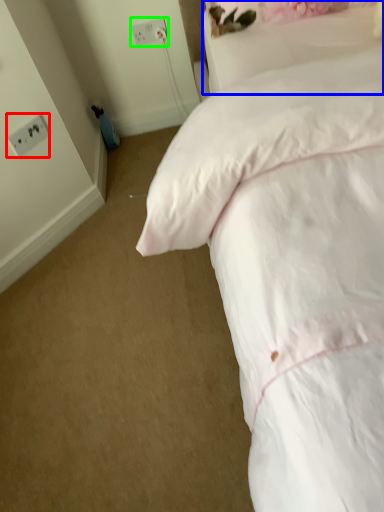
Question: Which is nearer to the electric outlet (highlighted by a red box)? pillow (highlighted by a blue box) or electric outlet (highlighted by a green box).

Choices:
 (A) pillow
 (B) electric outlet

Answer: (B)